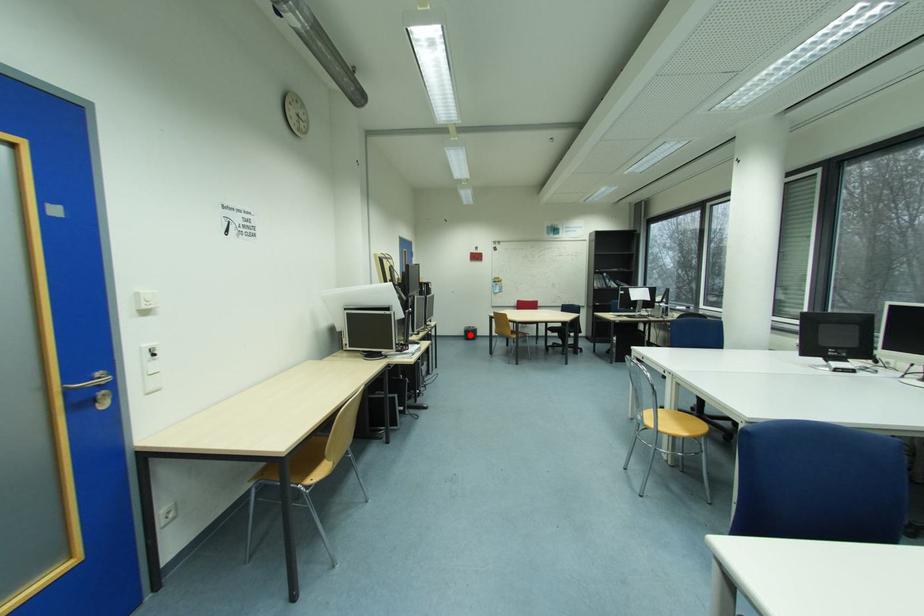
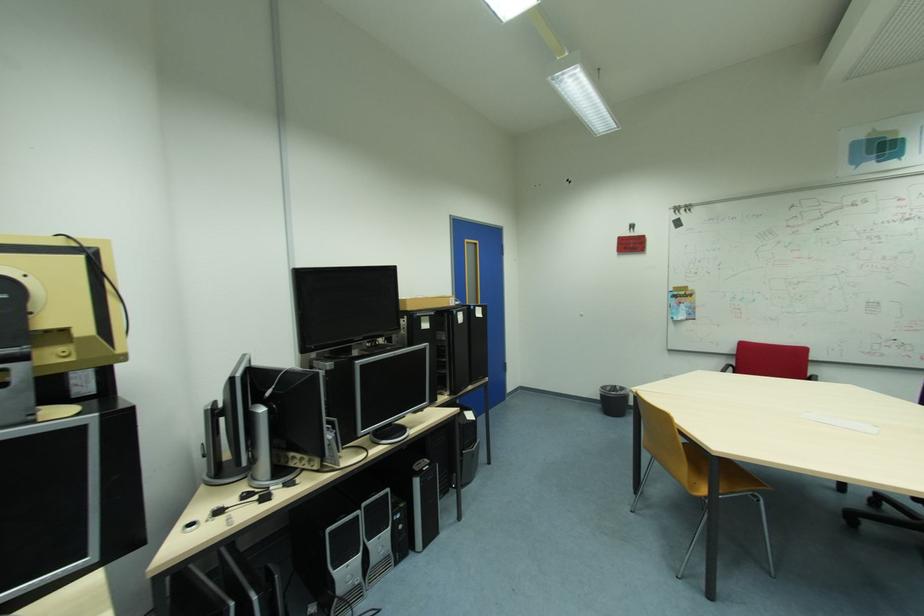
The point at the highlighted location is marked in the first image. Where is the corresponding point in the second image?

(605, 400)